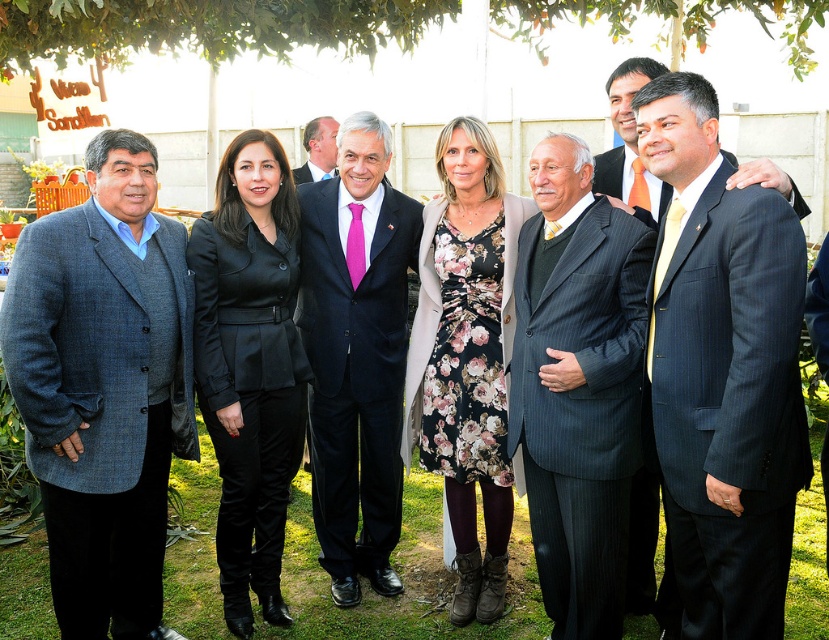
Question: Is matte black suit at center bigger than pink satin tie at center?

Choices:
 (A) no
 (B) yes

Answer: (A)

Question: Does dark blue pinstripe suit at right appear over gray pinstripe suit at center?

Choices:
 (A) yes
 (B) no

Answer: (B)

Question: Is gray woolen blazer at left in front of dark blue suit at center?

Choices:
 (A) no
 (B) yes

Answer: (B)

Question: Which object appears closest to the camera in this image?

Choices:
 (A) gray pinstripe suit at center
 (B) pink satin tie at center

Answer: (A)

Question: Among these objects, which one is nearest to the camera?

Choices:
 (A) gray woolen blazer at left
 (B) matte black suit at center
 (C) pink satin tie at center
 (D) gray pinstripe suit at center

Answer: (A)

Question: Based on their relative distances, which object is nearer to the floral dress at center?

Choices:
 (A) gray pinstripe suit at center
 (B) dark blue pinstripe suit at right

Answer: (A)